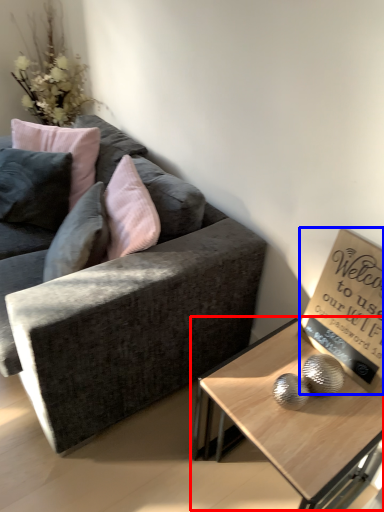
Question: Which point is closer to the camera, coffee table (highlighted by a red box) or bulletin board (highlighted by a blue box)?

Choices:
 (A) coffee table
 (B) bulletin board

Answer: (A)